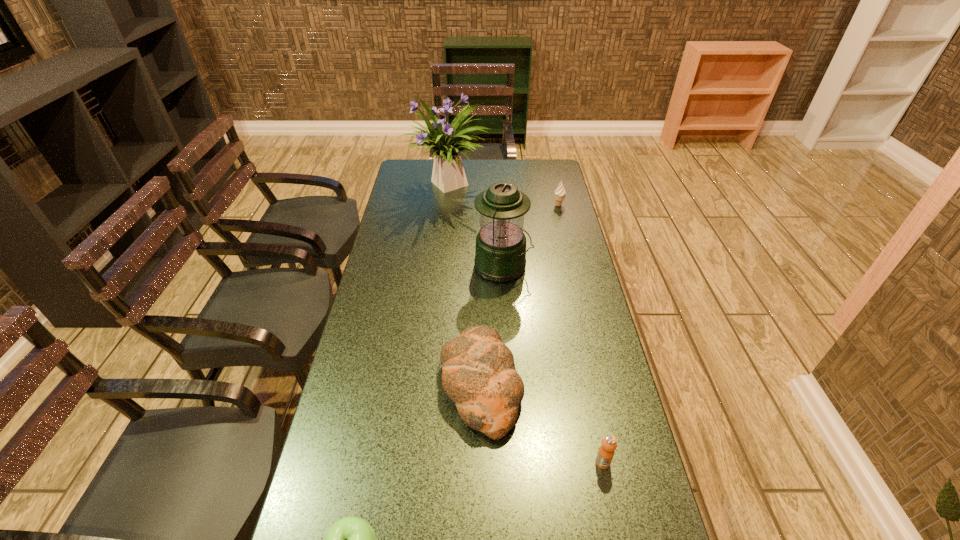
Identify the location of vacant space at the far right corner of the desktop. The width and height of the screenshot is (960, 540). (534, 165).

Locate an element on the screen. The image size is (960, 540). vacant region between the rightmost object and the fourth farthest object is located at coordinates click(519, 295).

Locate an element on the screen. The image size is (960, 540). free area in between the tallest object and the fourth nearest object is located at coordinates (475, 227).

Where is `free space between the fourth farthest object and the icecream`? free space between the fourth farthest object and the icecream is located at coordinates (519, 295).

This screenshot has width=960, height=540. I want to click on empty space that is in between the third nearest object and the rightmost object, so click(519, 295).

At what (x,y) coordinates should I click in order to perform the action: click on object that stands as the closest to the icecream. Please return your answer as a coordinate pair (x, y). Looking at the image, I should click on (448, 174).

What are the coordinates of `object that is the nearest to the second nearest object` in the screenshot? It's located at (478, 371).